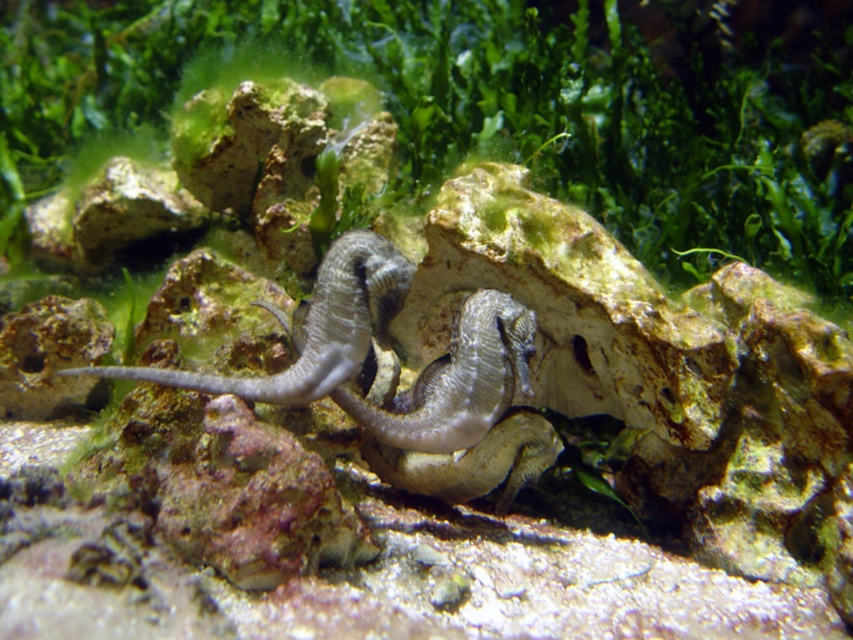
Question: Among these points, which one is farthest from the camera?

Choices:
 (A) (86, 145)
 (B) (206, 380)

Answer: (A)

Question: Observing the image, what is the correct spatial positioning of green algae at center in reference to gray matte seahorse at center?

Choices:
 (A) above
 (B) below

Answer: (A)

Question: Does green algae at center have a larger size compared to gray matte seahorse at center?

Choices:
 (A) yes
 (B) no

Answer: (A)

Question: Can you confirm if green algae at center is bigger than gray matte seahorse at center?

Choices:
 (A) no
 (B) yes

Answer: (B)